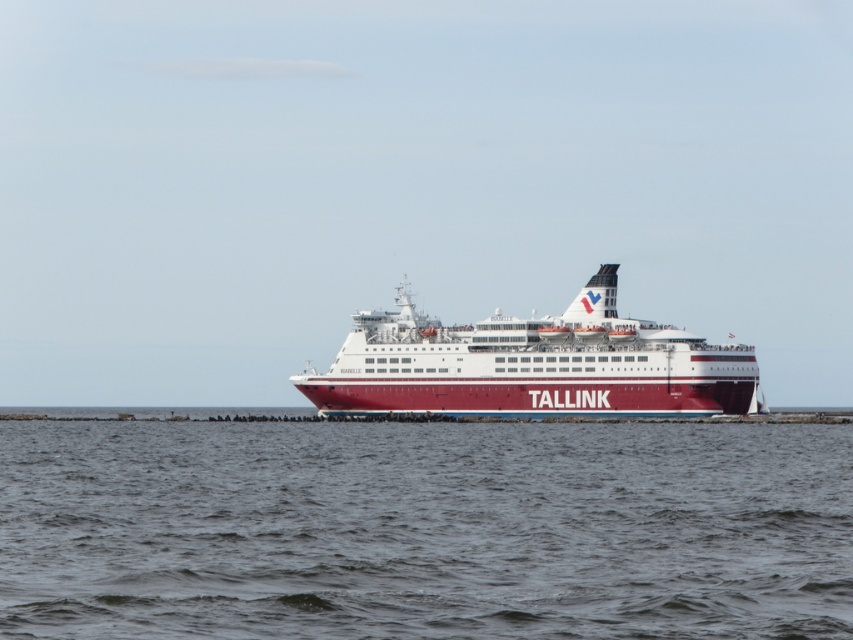
Question: Can you confirm if gray water at center is positioned to the right of red polished ship at center?

Choices:
 (A) yes
 (B) no

Answer: (B)

Question: Does gray water at center appear over red polished ship at center?

Choices:
 (A) yes
 (B) no

Answer: (B)

Question: Which point appears farthest from the camera in this image?

Choices:
 (A) (828, 476)
 (B) (618, 326)

Answer: (B)

Question: Does gray water at center lie behind red polished ship at center?

Choices:
 (A) yes
 (B) no

Answer: (B)